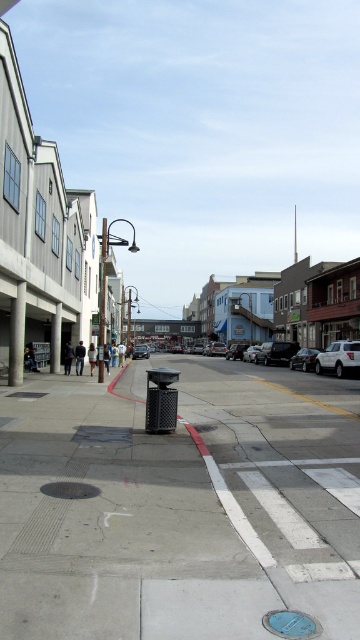
Question: Is concrete at center behind white matte car at right?

Choices:
 (A) no
 (B) yes

Answer: (A)

Question: Which of the following is the closest to the observer?

Choices:
 (A) shiny silver sedan at center-right
 (B) white matte car at right
 (C) concrete at center

Answer: (C)

Question: Which object is positioned closest to the concrete at center?

Choices:
 (A) shiny silver sedan at center-right
 (B) metallic silver sedan at center
 (C) white matte car at right

Answer: (C)

Question: Is concrete at center wider than shiny silver sedan at center-right?

Choices:
 (A) yes
 (B) no

Answer: (A)

Question: Which point is closer to the camera taking this photo?

Choices:
 (A) (225, 401)
 (B) (353, 348)

Answer: (A)

Question: From the image, what is the correct spatial relationship of white matte car at right in relation to shiny silver sedan at center-right?

Choices:
 (A) right
 (B) left

Answer: (A)